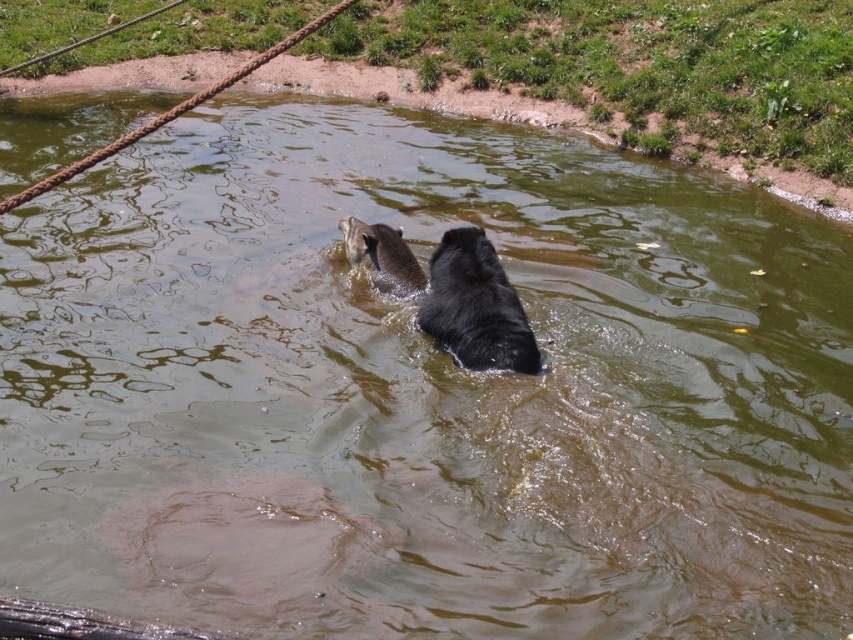
Consider the image. You are a zookeeper observing the black fur dog at center and the brown furry dog at upper center in the pond. Which dog has a greater height?

The black fur dog at center is taller than the brown furry dog at upper center.

You are a zookeeper trying to separate two dogs in a pond. The black fur dog at center and the brown furry dog at upper center are 3.37 feet apart. You have a 3.5 feet long pole. Can you reach both dogs with the pole?

The black fur dog at center and the brown furry dog at upper center are 3.37 feet apart. Since the pole is 3.5 feet long, which is slightly longer than the distance between them, you can reach both dogs with the pole.